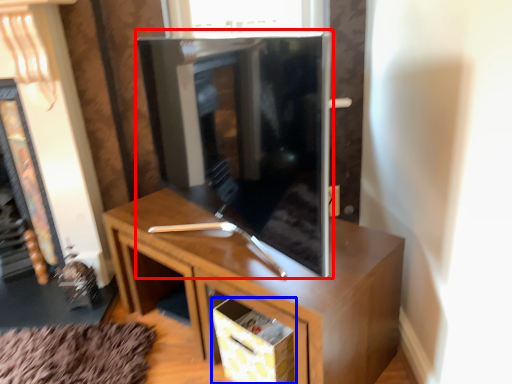
Question: Which point is further to the camera, tv cabinet (highlighted by a red box) or drawer (highlighted by a blue box)?

Choices:
 (A) tv cabinet
 (B) drawer

Answer: (B)